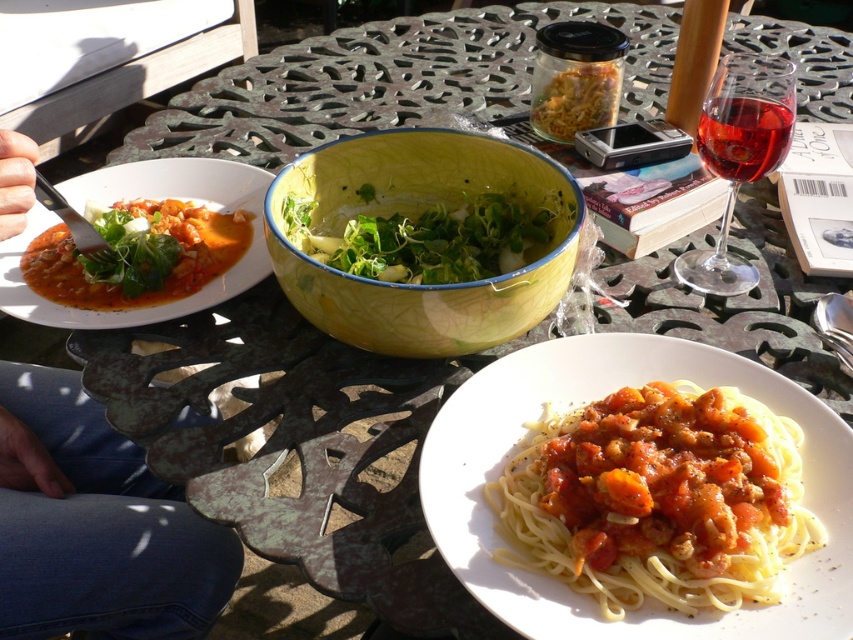
Between white matte spaghetti at lower right and red glass at upper right, which one is positioned higher?

red glass at upper right

Which is more to the right, white matte spaghetti at lower right or red glass at upper right?

red glass at upper right

Identify the location of white matte spaghetti at lower right. The image size is (853, 640). (659, 499).

Does blue jeans at lower left have a greater height compared to yellow glazed bowl at center?

Correct, blue jeans at lower left is much taller as yellow glazed bowl at center.

Does blue jeans at lower left come in front of yellow glazed bowl at center?

Yes, blue jeans at lower left is closer to the viewer.

Locate an element on the screen. blue jeans at lower left is located at coordinates (96, 524).

Between point (85, 448) and point (140, 296), which one is positioned behind?

The point (85, 448) is more distant.

What are the coordinates of `blue jeans at lower left` in the screenshot? It's located at (96, 524).